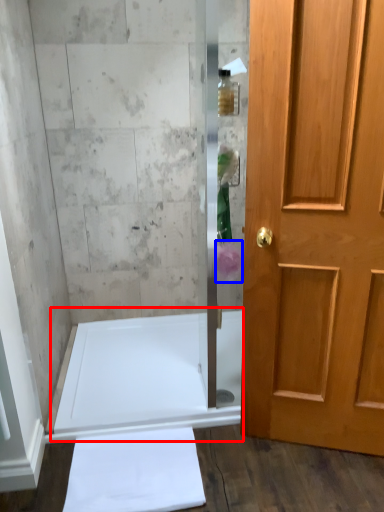
Question: Which of the following is the farthest to the observer, bath (highlighted by a red box) or flower (highlighted by a blue box)?

Choices:
 (A) bath
 (B) flower

Answer: (A)